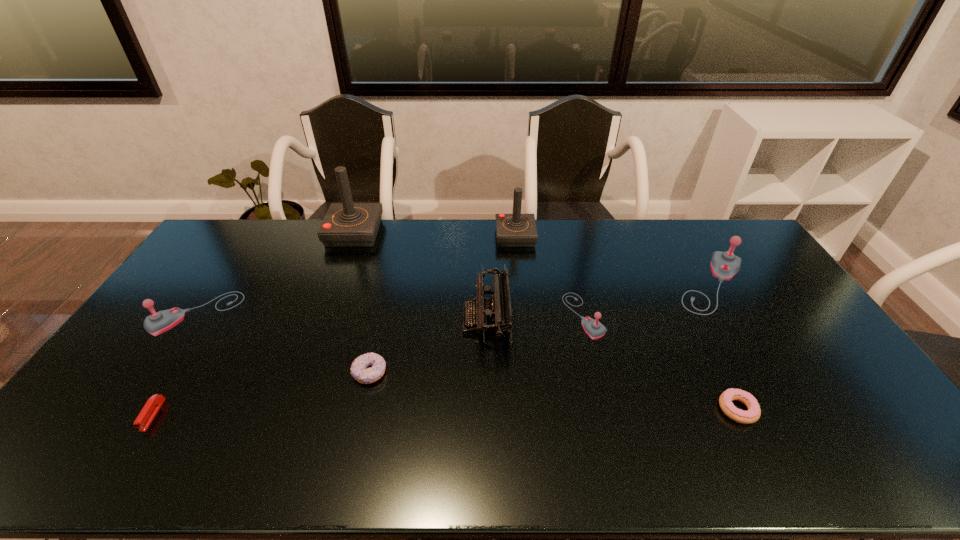
Find the location of `unoccupied area between the brown doughnut and the third joystick from left to right`. unoccupied area between the brown doughnut and the third joystick from left to right is located at coordinates (443, 305).

Find the location of a particular element. This screenshot has width=960, height=540. vacant point located between the sixth tallest object and the farther doughnut is located at coordinates (476, 344).

Identify the location of free point between the third joystick from right to left and the tallest object. (435, 235).

Where is `free space between the rightmost gray joystick and the pink doughnut`? free space between the rightmost gray joystick and the pink doughnut is located at coordinates (725, 347).

Choose which object is the third nearest neighbor to the leftmost joystick. Please provide its 2D coordinates. Your answer should be formatted as a tuple, i.e. [(x, y)], where the tuple contains the x and y coordinates of a point satisfying the conditions above.

[(359, 369)]

Identify which object is the second nearest to the second tallest joystick. Please provide its 2D coordinates. Your answer should be formatted as a tuple, i.e. [(x, y)], where the tuple contains the x and y coordinates of a point satisfying the conditions above.

[(594, 329)]

This screenshot has width=960, height=540. I want to click on joystick identified as the closest to the shortest joystick, so click(x=512, y=230).

Locate an element on the screen. This screenshot has width=960, height=540. joystick that is the second closest to the sixth object from right to left is located at coordinates (347, 224).

Point out which gray joystick is positioned as the nearest to the brown doughnut. Please provide its 2D coordinates. Your answer should be formatted as a tuple, i.e. [(x, y)], where the tuple contains the x and y coordinates of a point satisfying the conditions above.

[(158, 322)]

This screenshot has width=960, height=540. I want to click on gray joystick that is the closest one to the red stapler, so click(x=158, y=322).